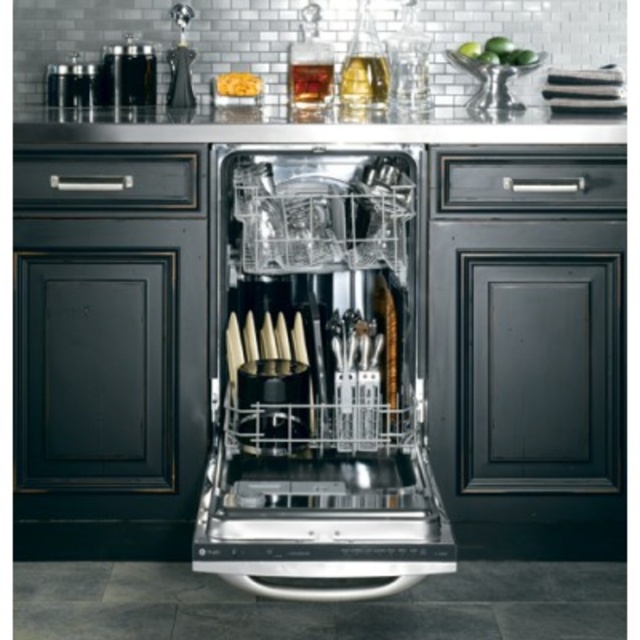
You are a chef preparing to season a dish. You see the satin steel countertop at upper center and the satin nickel salt and pepper shakers at left. Which object is higher in position?

The satin steel countertop at upper center is much taller than the satin nickel salt and pepper shakers at left, so the satin steel countertop at upper center is higher in position.